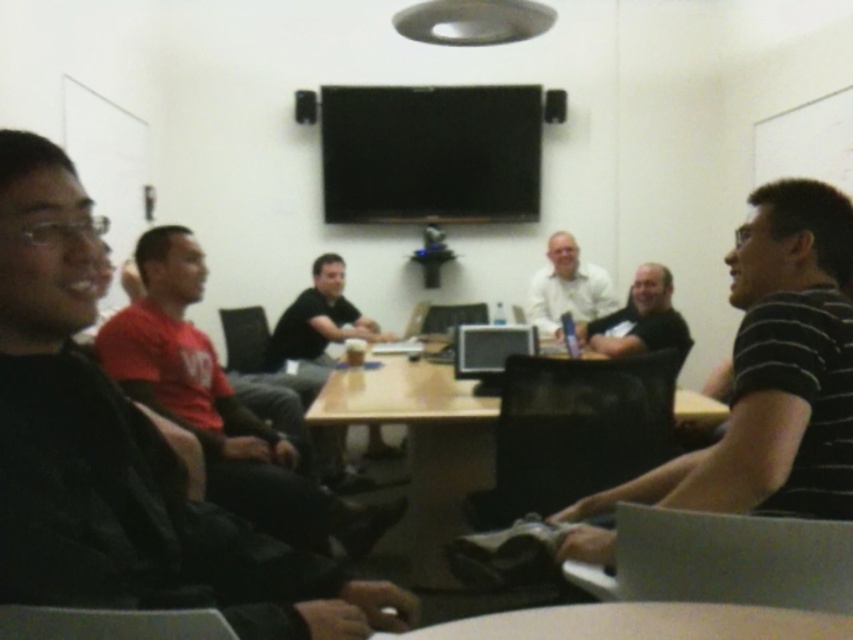
Question: Which point is farther to the camera?

Choices:
 (A) (300, 298)
 (B) (35, 512)
 (C) (659, 480)
 (D) (471, 438)

Answer: (A)

Question: Is black matte shirt at center to the right of matte black shirt at center from the viewer's perspective?

Choices:
 (A) no
 (B) yes

Answer: (A)

Question: Does black striped shirt at right appear over white matte shirt at center?

Choices:
 (A) yes
 (B) no

Answer: (B)

Question: Considering the real-world distances, which object is closest to the black matte shirt at center?

Choices:
 (A) wooden table at center
 (B) black striped shirt at right

Answer: (A)

Question: Is wooden table at center thinner than white glossy round table at lower center?

Choices:
 (A) no
 (B) yes

Answer: (A)

Question: Considering the real-world distances, which object is farthest from the white glossy round table at lower center?

Choices:
 (A) red matte shirt at left
 (B) matte black shirt at center

Answer: (B)